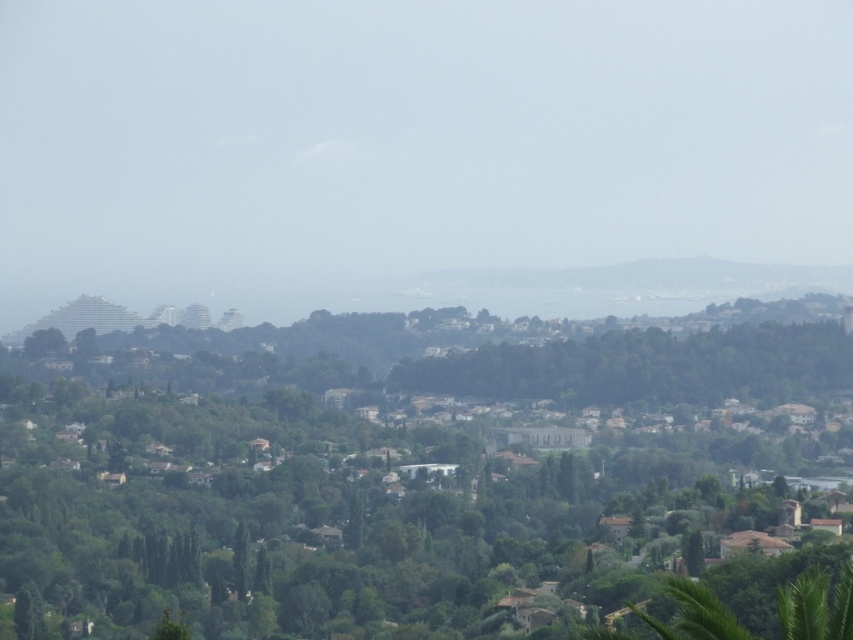
Question: Is transparent glass skyscraper at center to the right of green leafy tree at center from the viewer's perspective?

Choices:
 (A) yes
 (B) no

Answer: (A)

Question: Among these points, which one is farthest from the camera?

Choices:
 (A) (350, 225)
 (B) (804, 376)

Answer: (B)

Question: Is transparent glass skyscraper at center wider than green leafy tree at center?

Choices:
 (A) no
 (B) yes

Answer: (B)

Question: Can you confirm if transparent glass skyscraper at center is thinner than green leafy tree at center?

Choices:
 (A) no
 (B) yes

Answer: (A)